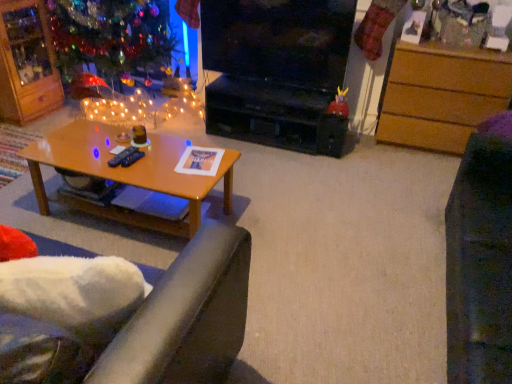
Question: Should I look upward or downward to see velvet purple swivel chair at right?

Choices:
 (A) down
 (B) up

Answer: (A)

Question: Can black plastic remote control at center, the 1th remote control positioned from the right, be found inside shiny glass christmas tree at upper left?

Choices:
 (A) yes
 (B) no

Answer: (B)

Question: Is shiny glass christmas tree at upper left bigger than black plastic remote control at center, the 2th remote control viewed from the left?

Choices:
 (A) no
 (B) yes

Answer: (B)

Question: Does shiny glass christmas tree at upper left turn towards black plastic remote control at center, the 1th remote control positioned from the right?

Choices:
 (A) yes
 (B) no

Answer: (B)

Question: Is shiny glass christmas tree at upper left shorter than black plastic remote control at center, the 1th remote control positioned from the right?

Choices:
 (A) no
 (B) yes

Answer: (A)

Question: Considering the relative positions of shiny glass christmas tree at upper left and black plastic remote control at center, the 2th remote control viewed from the left, in the image provided, is shiny glass christmas tree at upper left in front of black plastic remote control at center, the 2th remote control viewed from the left,?

Choices:
 (A) yes
 (B) no

Answer: (B)

Question: From a real-world perspective, is shiny glass christmas tree at upper left on top of black plastic remote control at center, the 2th remote control viewed from the left?

Choices:
 (A) no
 (B) yes

Answer: (B)

Question: Considering the relative sizes of wooden cabinet at upper left and satin blue remote control at center, which is counted as the second remote control, starting from the right, in the image provided, is wooden cabinet at upper left taller than satin blue remote control at center, which is counted as the second remote control, starting from the right,?

Choices:
 (A) yes
 (B) no

Answer: (A)

Question: Could you tell me if wooden cabinet at upper left is facing satin blue remote control at center, which is the 1th remote control from left to right?

Choices:
 (A) no
 (B) yes

Answer: (A)

Question: From a real-world perspective, does wooden cabinet at upper left stand above satin blue remote control at center, which is counted as the second remote control, starting from the right?

Choices:
 (A) no
 (B) yes

Answer: (B)

Question: From the image's perspective, is wooden cabinet at upper left located above satin blue remote control at center, which is the 1th remote control from left to right?

Choices:
 (A) no
 (B) yes

Answer: (B)

Question: From the image's perspective, is wooden cabinet at upper left located beneath satin blue remote control at center, which is counted as the second remote control, starting from the right?

Choices:
 (A) yes
 (B) no

Answer: (B)

Question: Can you confirm if wooden cabinet at upper left is bigger than satin blue remote control at center, which is counted as the second remote control, starting from the right?

Choices:
 (A) yes
 (B) no

Answer: (A)

Question: From a real-world perspective, is wooden drawer at right positioned under black glossy television at center based on gravity?

Choices:
 (A) yes
 (B) no

Answer: (A)